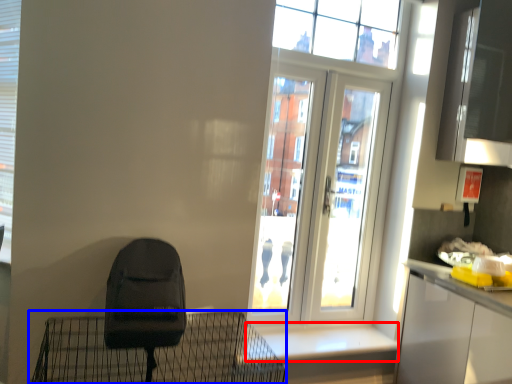
Question: Which object is closer to the camera taking this photo, window sill (highlighted by a red box) or furniture (highlighted by a blue box)?

Choices:
 (A) window sill
 (B) furniture

Answer: (B)